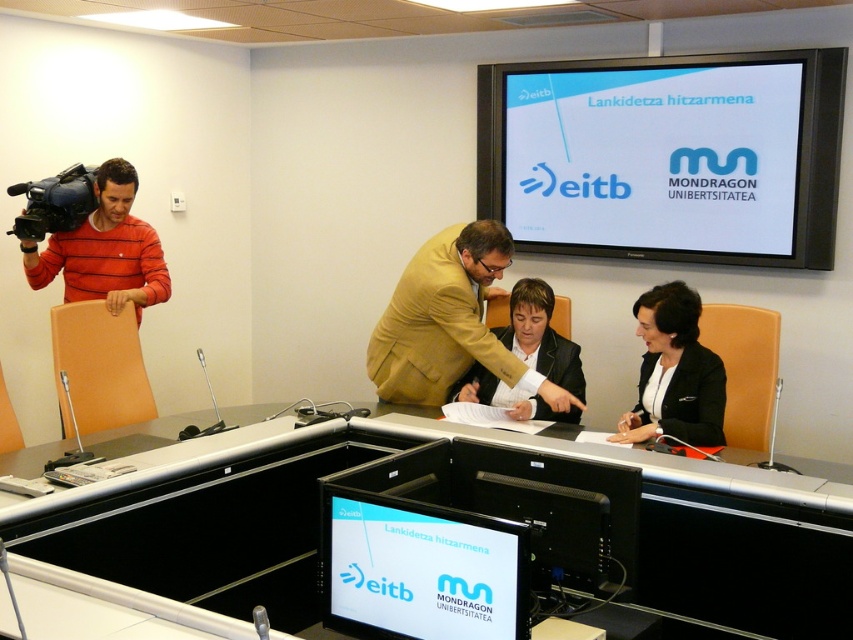
Does point (496, 508) lie behind point (689, 339)?

That is False.

Image resolution: width=853 pixels, height=640 pixels. Identify the location of smooth black table at center. (422, 500).

In the scene shown: Can you confirm if matte black monitor at center is smaller than black glossy monitor at center?

Correct, matte black monitor at center occupies less space than black glossy monitor at center.

Can you confirm if matte black monitor at center is shorter than black glossy monitor at center?

Yes.

Between point (361, 499) and point (535, 566), which one is positioned behind?

Positioned behind is point (535, 566).

Locate an element on the screen. This screenshot has height=640, width=853. matte black monitor at center is located at coordinates (421, 570).

Describe the element at coordinates (666, 156) in the screenshot. I see `white glossy projection screen at upper center` at that location.

Is white glossy projection screen at upper center closer to the viewer compared to matte black monitor at center?

No, it is behind matte black monitor at center.

Is point (671, 257) positioned behind point (418, 506)?

Yes, point (671, 257) is farther from viewer.

You are a GUI agent. You are given a task and a screenshot of the screen. Output one action in this format:
    pyautogui.click(x=<x>, y=<y>)
    Task: Click on the white glossy projection screen at upper center
    This screenshot has width=853, height=640.
    Given the screenshot: What is the action you would take?
    pyautogui.click(x=666, y=156)